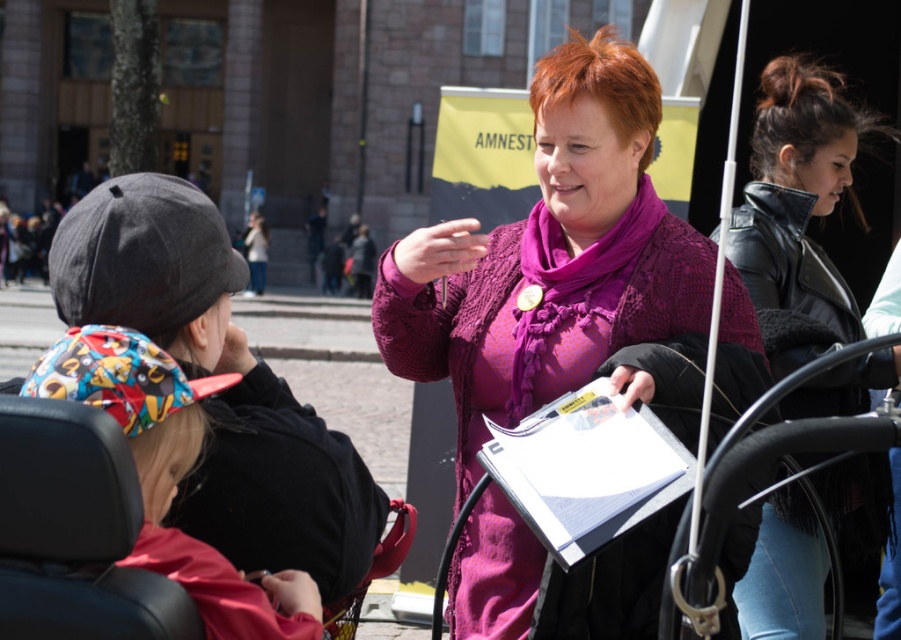
You are a photographer at the event and want to take a photo of the purple lace cardigan at center and the white paper clipboard at center. Which object should you focus on first to ensure both are in focus?

The purple lace cardigan at center is closer to you than the white paper clipboard at center, so you should focus on the purple lace cardigan at center first to ensure both are in focus.

You are a photographer at the event and want to capture a photo of the leather jacket at right. According to the coordinates provided, where should you focus your camera?

The leather jacket at right is located at coordinates point (798, 193). Focus your camera there to capture it.